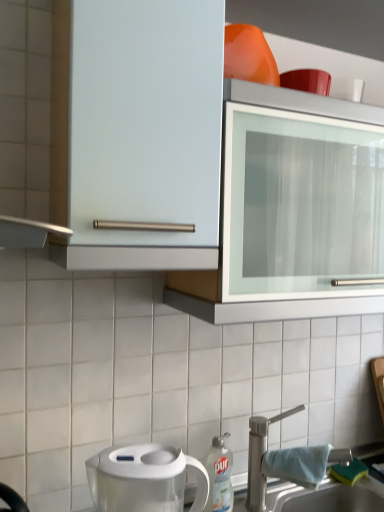
Question: Considering the relative sizes of transparent plastic water filter pitcher at lower left and white plastic dish soap bottle at lower center in the image provided, is transparent plastic water filter pitcher at lower left shorter than white plastic dish soap bottle at lower center?

Choices:
 (A) no
 (B) yes

Answer: (B)

Question: Could you tell me if transparent plastic water filter pitcher at lower left is facing white plastic dish soap bottle at lower center?

Choices:
 (A) no
 (B) yes

Answer: (A)

Question: Does transparent plastic water filter pitcher at lower left have a greater height compared to white plastic dish soap bottle at lower center?

Choices:
 (A) yes
 (B) no

Answer: (B)

Question: From the image's perspective, is transparent plastic water filter pitcher at lower left under white plastic dish soap bottle at lower center?

Choices:
 (A) no
 (B) yes

Answer: (A)

Question: Considering the relative positions of transparent plastic water filter pitcher at lower left and white plastic dish soap bottle at lower center in the image provided, is transparent plastic water filter pitcher at lower left to the right of white plastic dish soap bottle at lower center from the viewer's perspective?

Choices:
 (A) yes
 (B) no

Answer: (B)

Question: Does transparent plastic water filter pitcher at lower left contain white plastic dish soap bottle at lower center?

Choices:
 (A) yes
 (B) no

Answer: (B)

Question: Considering the relative sizes of transparent plastic water filter pitcher at lower left and white metallic tap at lower right in the image provided, is transparent plastic water filter pitcher at lower left wider than white metallic tap at lower right?

Choices:
 (A) no
 (B) yes

Answer: (B)

Question: From a real-world perspective, is transparent plastic water filter pitcher at lower left beneath white metallic tap at lower right?

Choices:
 (A) no
 (B) yes

Answer: (A)

Question: Is transparent plastic water filter pitcher at lower left to the right of white metallic tap at lower right from the viewer's perspective?

Choices:
 (A) yes
 (B) no

Answer: (B)

Question: Does transparent plastic water filter pitcher at lower left have a lesser width compared to white metallic tap at lower right?

Choices:
 (A) yes
 (B) no

Answer: (B)

Question: Considering the relative positions of transparent plastic water filter pitcher at lower left and white metallic tap at lower right in the image provided, is transparent plastic water filter pitcher at lower left in front of white metallic tap at lower right?

Choices:
 (A) no
 (B) yes

Answer: (B)

Question: Does transparent plastic water filter pitcher at lower left have a greater height compared to white metallic tap at lower right?

Choices:
 (A) yes
 (B) no

Answer: (B)

Question: Does white metallic tap at lower right have a smaller size compared to transparent plastic water filter pitcher at lower left?

Choices:
 (A) no
 (B) yes

Answer: (A)